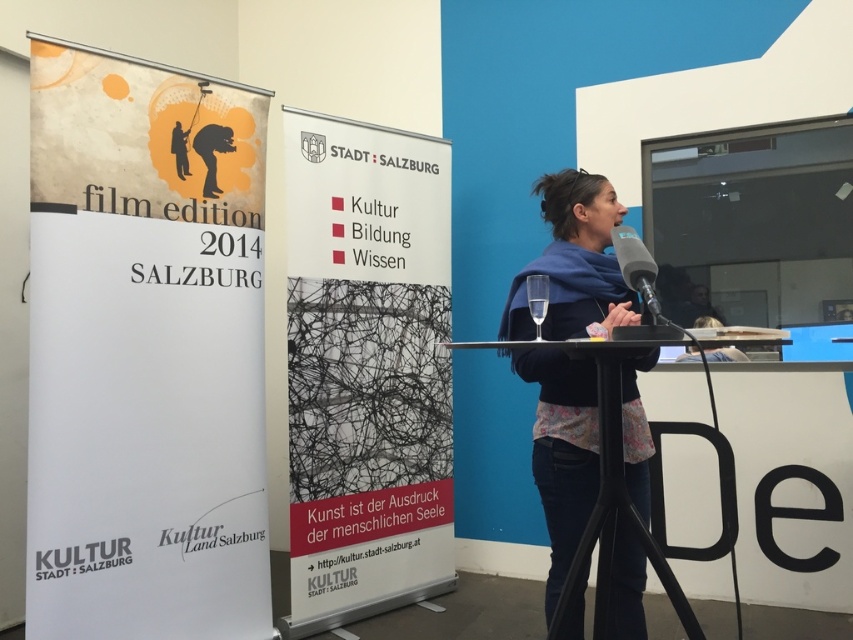
Which is in front, point (630, 275) or point (178, 138)?

Point (630, 275)

Is matte black microphone at center above matte black figure at upper left?

Actually, matte black microphone at center is below matte black figure at upper left.

Which is in front, point (637, 288) or point (181, 129)?

Point (637, 288) is in front.

In order to click on matte black microphone at center in this screenshot , I will do `click(637, 268)`.

Is black matte poster at center behind matte black microphone at center?

Yes, it is behind matte black microphone at center.

Is point (337, 461) positioned in front of point (614, 236)?

No.

I want to click on black matte poster at center, so click(x=366, y=369).

Does black matte poster at center have a larger size compared to matte black figure at upper left?

Yes, black matte poster at center is bigger than matte black figure at upper left.

Who is more forward, (345, 307) or (177, 138)?

Point (177, 138)

This screenshot has width=853, height=640. Find the location of `black matte poster at center`. black matte poster at center is located at coordinates (366, 369).